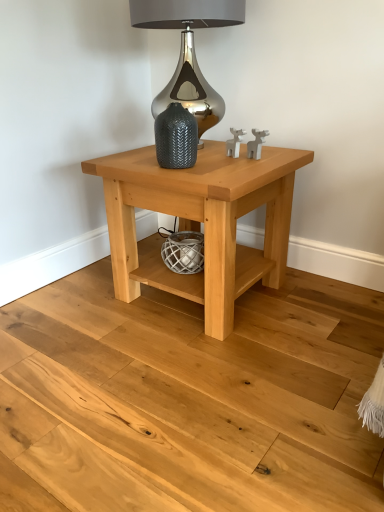
Question: Can you confirm if natural wood floor at lower center is shorter than natural wood table at center?

Choices:
 (A) no
 (B) yes

Answer: (B)

Question: Would you say natural wood floor at lower center is a long distance from natural wood table at center?

Choices:
 (A) no
 (B) yes

Answer: (A)

Question: From a real-world perspective, is natural wood floor at lower center beneath natural wood table at center?

Choices:
 (A) yes
 (B) no

Answer: (A)

Question: From the image's perspective, does natural wood floor at lower center appear lower than natural wood table at center?

Choices:
 (A) yes
 (B) no

Answer: (A)

Question: From a real-world perspective, is natural wood floor at lower center positioned over natural wood table at center based on gravity?

Choices:
 (A) no
 (B) yes

Answer: (A)

Question: Considering the relative sizes of natural wood floor at lower center and natural wood table at center in the image provided, is natural wood floor at lower center taller than natural wood table at center?

Choices:
 (A) yes
 (B) no

Answer: (B)

Question: From the image's perspective, is textured gray vase at center beneath satin silver lamp at upper center?

Choices:
 (A) yes
 (B) no

Answer: (A)

Question: Is textured gray vase at center taller than satin silver lamp at upper center?

Choices:
 (A) yes
 (B) no

Answer: (B)

Question: Does textured gray vase at center turn towards satin silver lamp at upper center?

Choices:
 (A) yes
 (B) no

Answer: (B)

Question: Is textured gray vase at center turned away from satin silver lamp at upper center?

Choices:
 (A) no
 (B) yes

Answer: (B)

Question: Is there a large distance between textured gray vase at center and satin silver lamp at upper center?

Choices:
 (A) no
 (B) yes

Answer: (A)

Question: Considering the relative positions of textured gray vase at center and satin silver lamp at upper center in the image provided, is textured gray vase at center behind satin silver lamp at upper center?

Choices:
 (A) yes
 (B) no

Answer: (B)

Question: Does natural wood table at center have a greater height compared to textured gray vase at center?

Choices:
 (A) yes
 (B) no

Answer: (A)